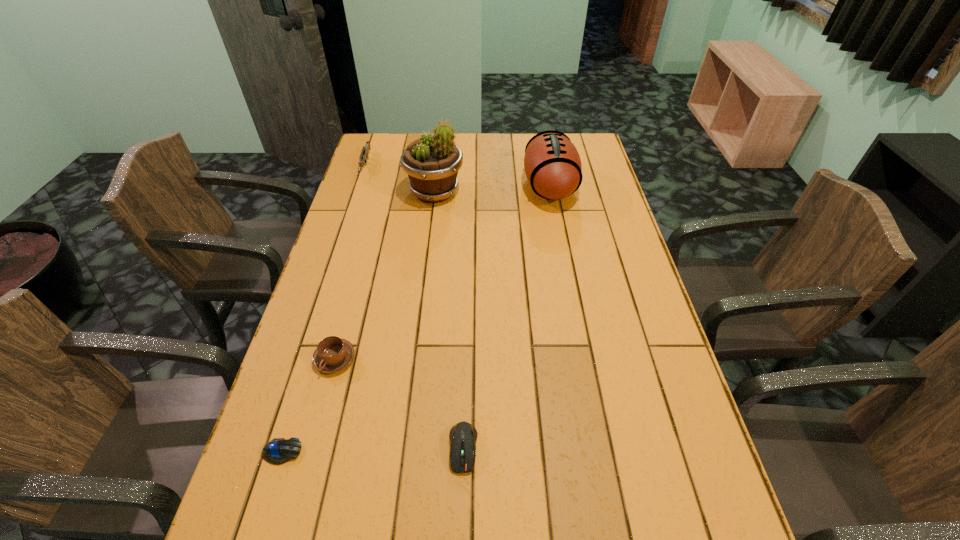
Locate an element on the screen. vacant space that satisfies the following two spatial constraints: 1. aimed along the barrel of the fifth shortest object; 2. on the right side of the gun is located at coordinates (359, 186).